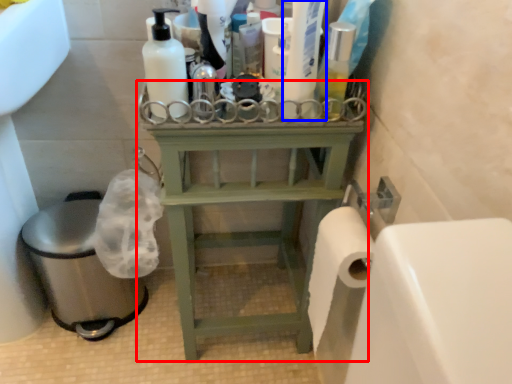
Question: Which object appears farthest to the camera in this image, furniture (highlighted by a red box) or cleaning product (highlighted by a blue box)?

Choices:
 (A) furniture
 (B) cleaning product

Answer: (A)